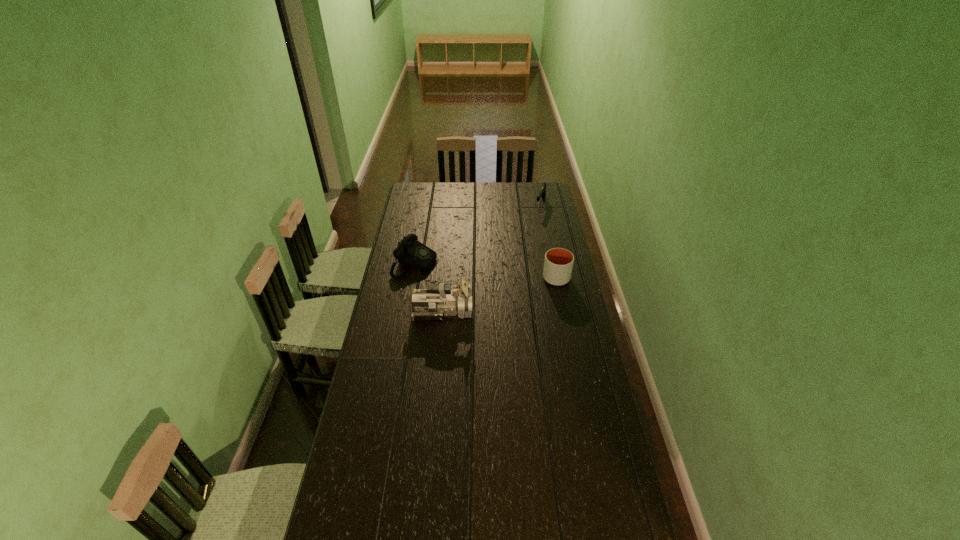
This screenshot has height=540, width=960. In the image, there is a desktop. What are the coordinates of `vacant space at the left edge` in the screenshot? It's located at (398, 294).

You are a GUI agent. You are given a task and a screenshot of the screen. Output one action in this format:
    pyautogui.click(x=<x>, y=<y>)
    Task: Click on the free space at the right edge
    The image size is (960, 540).
    Given the screenshot: What is the action you would take?
    pyautogui.click(x=559, y=288)

At what (x,y) coordinates should I click in order to perform the action: click on free space between the cup and the telephone. Please return your answer as a coordinate pair (x, y). The width and height of the screenshot is (960, 540). Looking at the image, I should click on 486,271.

Locate an element on the screen. This screenshot has width=960, height=540. unoccupied area between the telephone and the cup is located at coordinates (486, 271).

In order to click on free area in between the telephone and the farthest object in this screenshot , I will do `click(478, 234)`.

Identify the location of vacant space that's between the cup and the telephone. Image resolution: width=960 pixels, height=540 pixels. (486, 271).

The width and height of the screenshot is (960, 540). Find the location of `empty space that is in between the nearest object and the cup`. empty space that is in between the nearest object and the cup is located at coordinates (499, 295).

Image resolution: width=960 pixels, height=540 pixels. I want to click on free space between the nearest object and the cup, so click(499, 295).

The image size is (960, 540). Identify the location of unoccupied area between the tallest object and the cup. (499, 295).

Identify the location of blank region between the telephone and the gun. (478, 234).